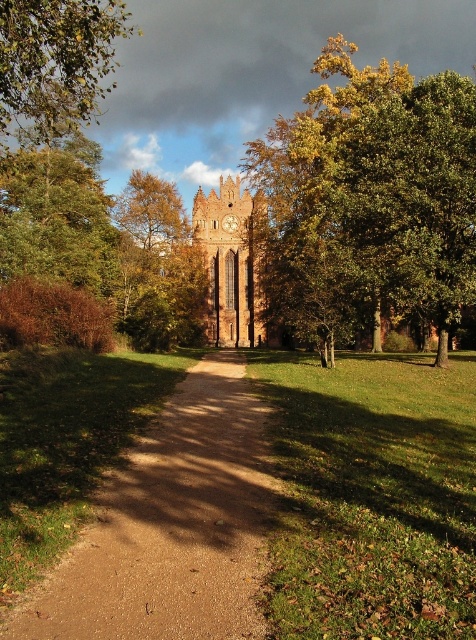
You are a photographer planning to capture the church and its surroundings. You want to ensure both the green leafy tree at upper right and the wooden clock at center are visible in your shot. Based on their heights, which object will appear taller in the photograph?

The green leafy tree at upper right will appear taller in the photograph since it has a greater height compared to the wooden clock at center.

You are standing at the point where the path meets the church entrance. Looking towards the historic brick church, you notice a point marked at coordinates [370,196]. What object does this point correspond to?

The point at coordinates [370,196] corresponds to the green leafy tree at upper right.